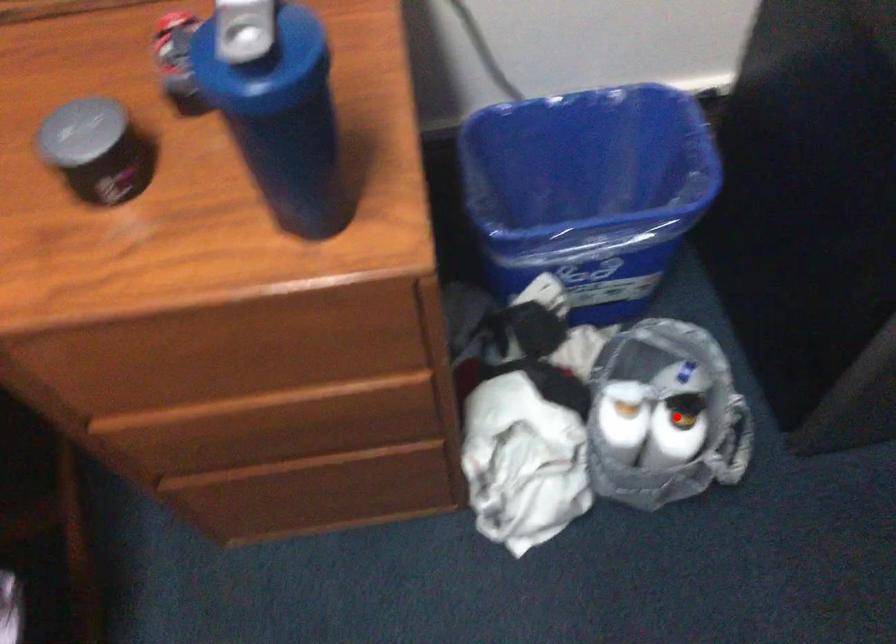
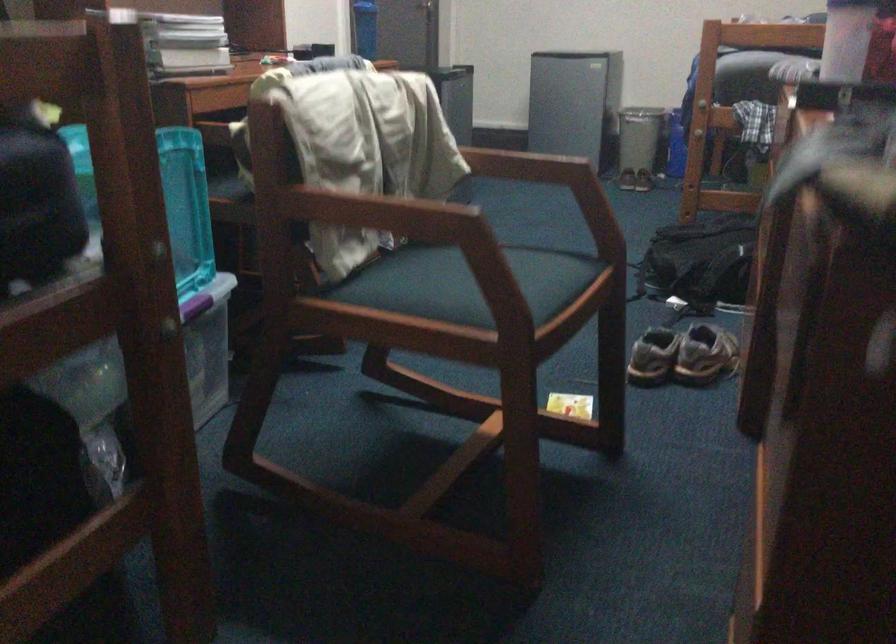
Question: I am providing you with two images of the same scene from different viewpoints. A red point is marked on the first image. At the location where the point appears in image 1, is it still visible in image 2?

Choices:
 (A) Yes
 (B) No

Answer: (B)